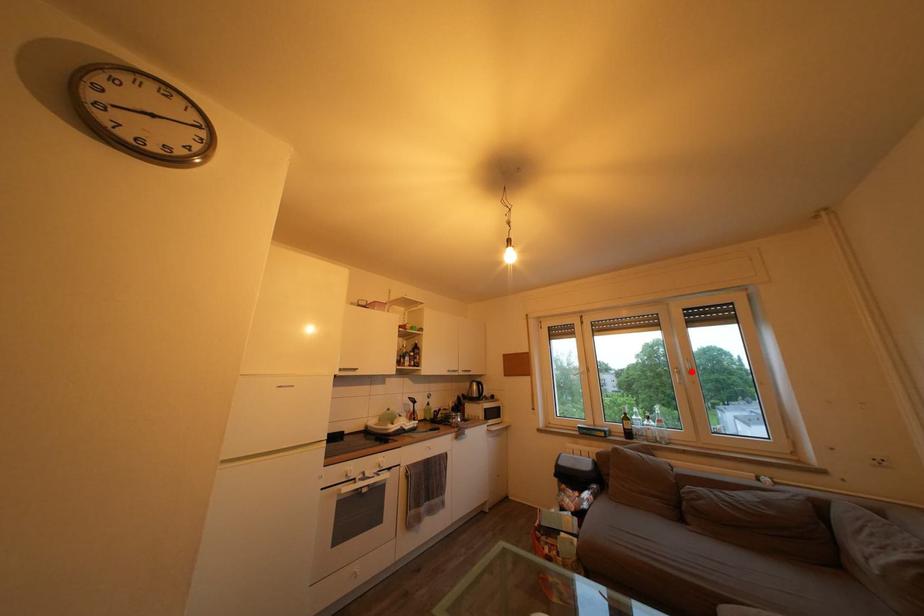
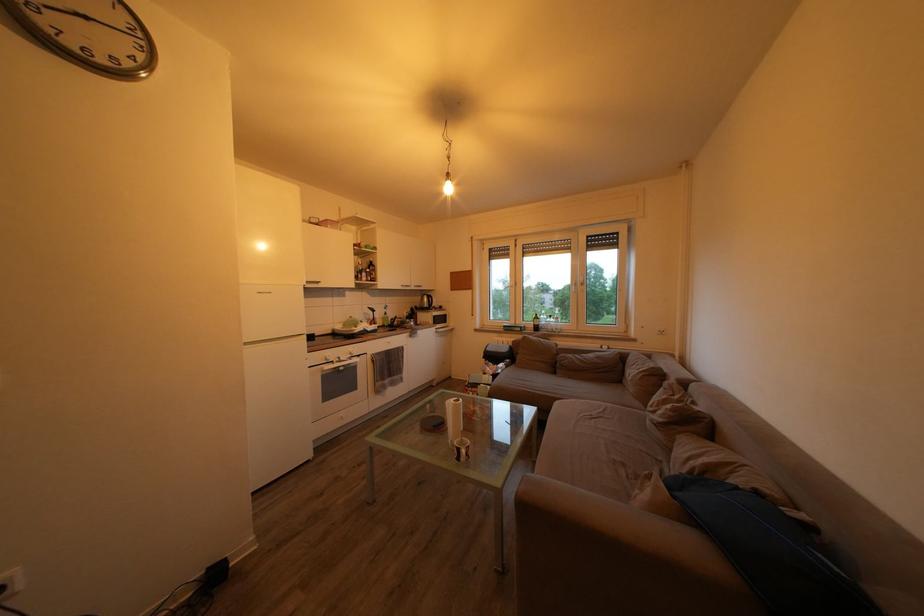
Where in the second image is the point corresponding to the highlighted location from the first image?

(588, 286)